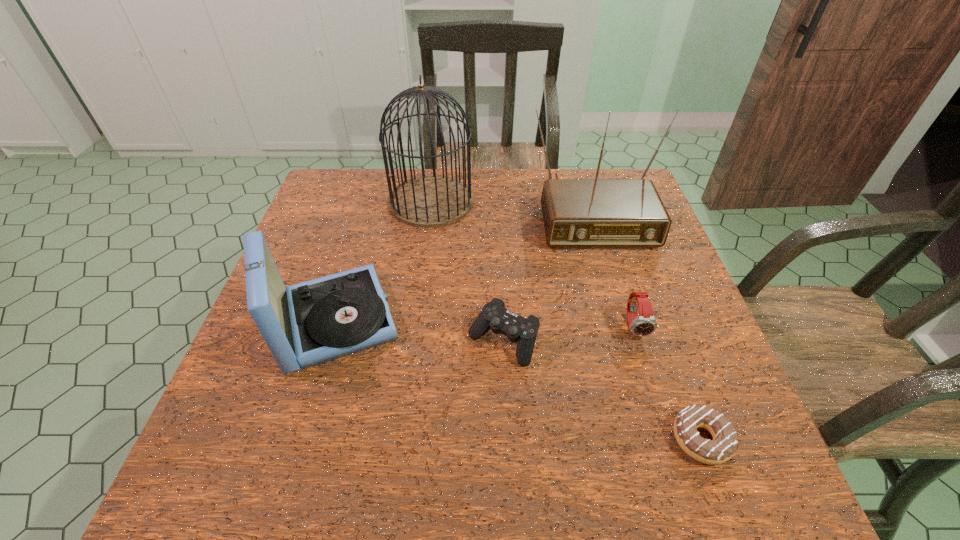
The height and width of the screenshot is (540, 960). I want to click on object that is at the far right corner, so click(577, 213).

Image resolution: width=960 pixels, height=540 pixels. What are the coordinates of `object at the near right corner` in the screenshot? It's located at (724, 444).

What are the coordinates of `free space at the far edge` in the screenshot? It's located at (562, 169).

Locate an element on the screen. vacant space at the near edge is located at coordinates (400, 477).

Identify the location of vacant space at the left edge of the desktop. (257, 388).

At what (x,y) coordinates should I click in order to perform the action: click on free region at the far left corner of the desktop. Please return your answer as a coordinate pair (x, y). Looking at the image, I should click on (344, 187).

In the image, there is a desktop. Where is `vacant space at the far right corner`? vacant space at the far right corner is located at coordinates (584, 176).

You are a GUI agent. You are given a task and a screenshot of the screen. Output one action in this format:
    pyautogui.click(x=<x>, y=<y>)
    Task: Click on the free spot between the radio_receiver and the fifth tallest object
    This screenshot has width=960, height=540.
    Given the screenshot: What is the action you would take?
    pyautogui.click(x=546, y=275)

The height and width of the screenshot is (540, 960). In order to click on unoccupied position between the birdcage and the third tallest object in this screenshot , I will do `click(383, 261)`.

At what (x,y) coordinates should I click in order to perform the action: click on free point between the birdcage and the fifth shortest object. Please return your answer as a coordinate pair (x, y). This screenshot has width=960, height=540. Looking at the image, I should click on (510, 205).